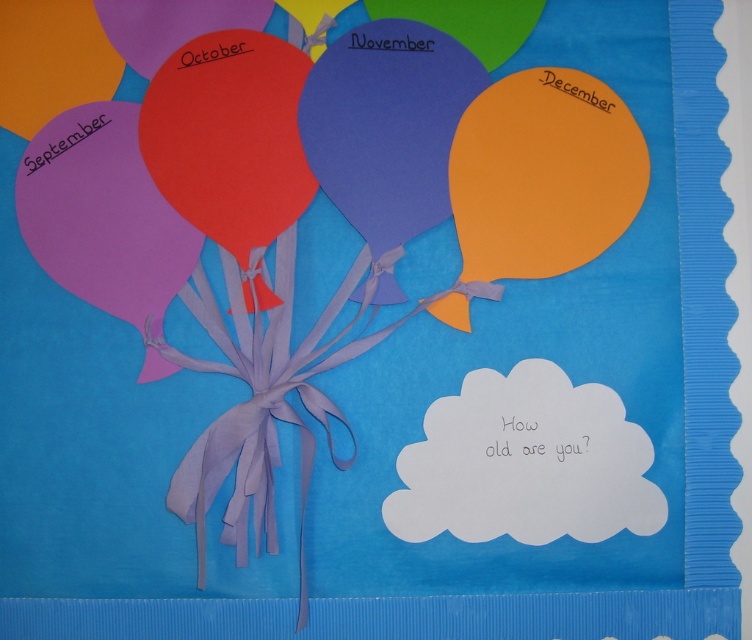
You are a child trying to reach the balloons on the bulletin board. The purple paper balloon at left and the matte orange balloon at upper right are both within your reach. Which balloon should you grab first to get the closest one?

The purple paper balloon at left is closer to the viewer than the matte orange balloon at upper right, so you should grab the purple paper balloon at left first.

You are organizing a school event and need to hang decorations. You have two orange balloons, the orange paper balloon at upper right and the matte orange balloon at upper center. Which one should you choose if you want the taller balloon for the top of the entrance?

The orange paper balloon at upper right is taller than the matte orange balloon at upper center, so you should choose the orange paper balloon at upper right for the top of the entrance.

You are looking at the bulletin board and notice a point marked at coordinates (x=543, y=173). What object is located at this point?

The orange paper balloon at upper right is located at point (x=543, y=173).